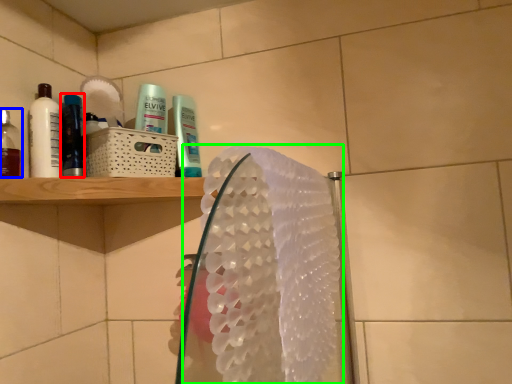
Question: Based on their relative distances, which object is farther from mouthwash (highlighted by a red box)? Choose from mouthwash (highlighted by a blue box) and hand towel (highlighted by a green box).

Choices:
 (A) mouthwash
 (B) hand towel

Answer: (B)